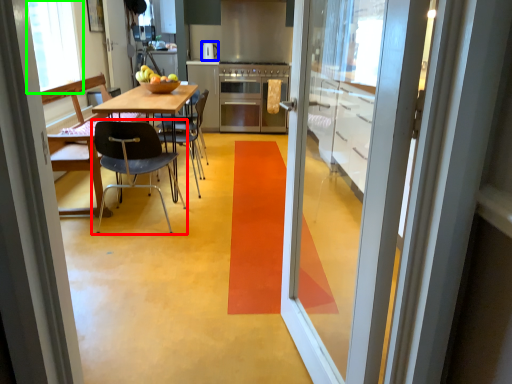
Question: Considering the real-world distances, which object is closest to chair (highlighted by a red box)? appliance (highlighted by a blue box) or window screen (highlighted by a green box).

Choices:
 (A) appliance
 (B) window screen

Answer: (B)